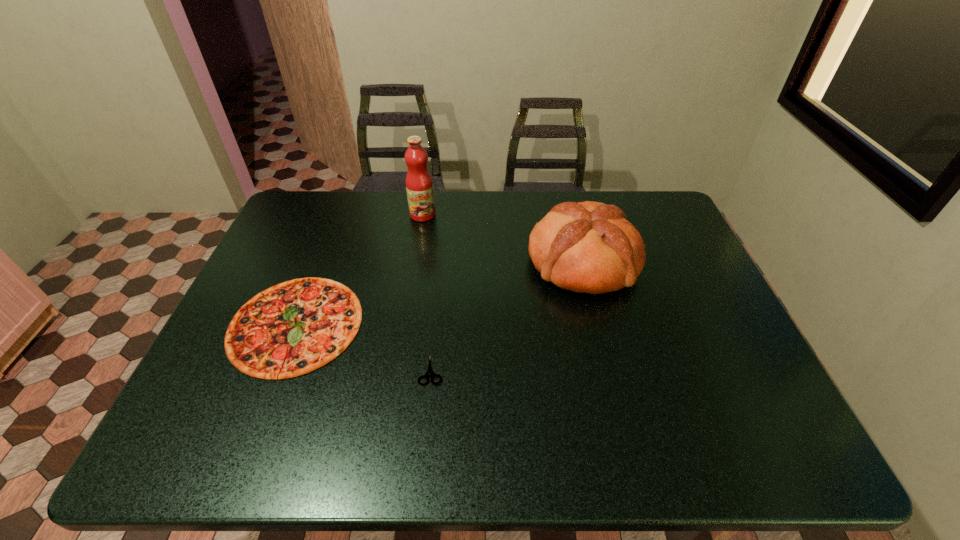
Locate an element on the screen. This screenshot has height=540, width=960. free point between the third tallest object and the tallest object is located at coordinates (359, 269).

Locate which object is the third closest to the second shortest object. Please provide its 2D coordinates. Your answer should be formatted as a tuple, i.e. [(x, y)], where the tuple contains the x and y coordinates of a point satisfying the conditions above.

[(589, 247)]

Image resolution: width=960 pixels, height=540 pixels. I want to click on the third closest object to the second object from right to left, so [419, 185].

Identify the location of blank area in the image that satisfies the following two spatial constraints: 1. on the front label of the second object from right to left; 2. on the right side of the farthest object. (398, 371).

Locate an element on the screen. blank area in the image that satisfies the following two spatial constraints: 1. on the front label of the shortest object; 2. on the right side of the third object from right to left is located at coordinates (398, 371).

The image size is (960, 540). I want to click on blank space that satisfies the following two spatial constraints: 1. on the back side of the shears; 2. on the right side of the rightmost object, so click(x=441, y=262).

The height and width of the screenshot is (540, 960). Identify the location of free space that satisfies the following two spatial constraints: 1. on the front label of the shortest object; 2. on the right side of the fruit juice. (398, 371).

Image resolution: width=960 pixels, height=540 pixels. What are the coordinates of `free point that satisfies the following two spatial constraints: 1. on the front label of the farthest object; 2. on the right side of the third object from left to right` in the screenshot? It's located at (398, 371).